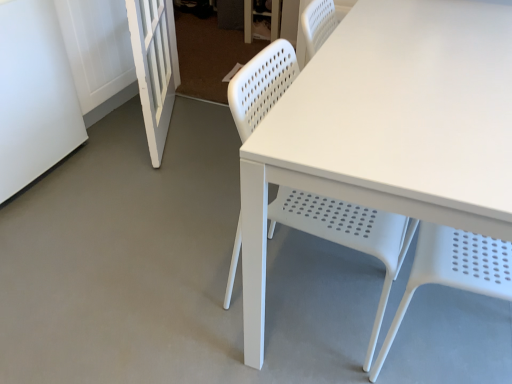
Find the location of a particular element. This screenshot has width=512, height=384. free area below white plastic chair at center (from a real-world perspective) is located at coordinates click(x=312, y=291).